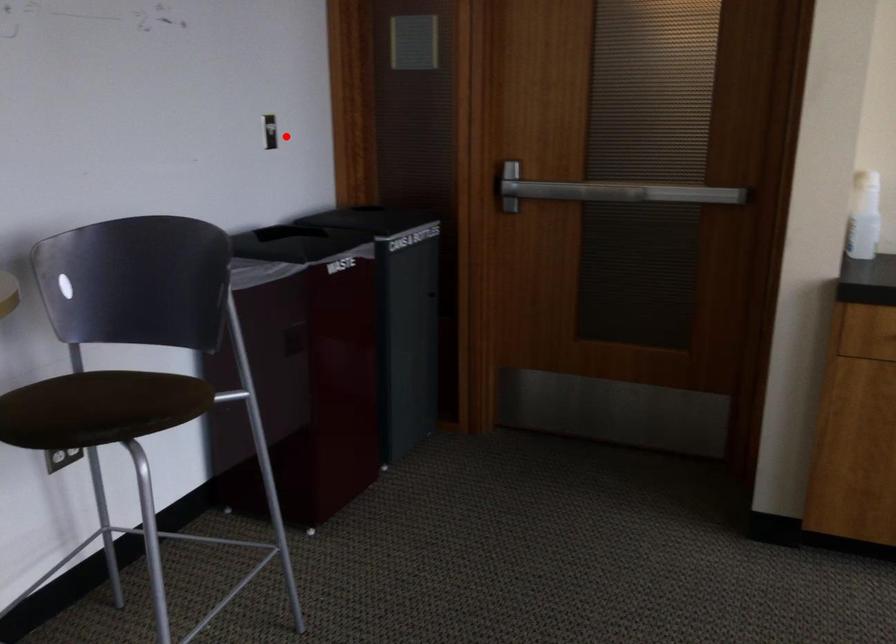
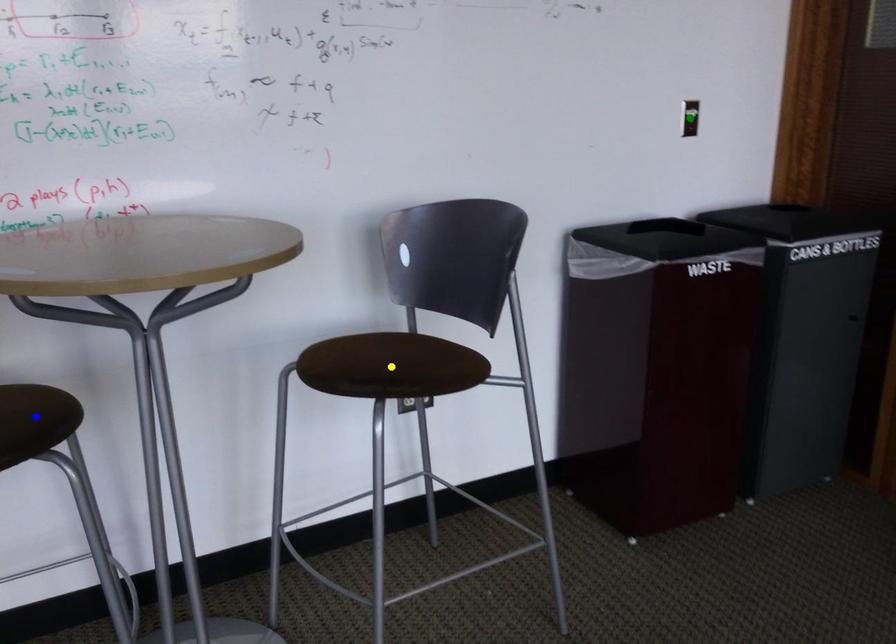
Question: I am providing you with two images of the same scene from different viewpoints. A red point is marked on the first image. You are given multiple points on the second image. Which point in image 2 represents the same 3d spot as the red point in image 1?

Choices:
 (A) green point
 (B) blue point
 (C) yellow point

Answer: (A)